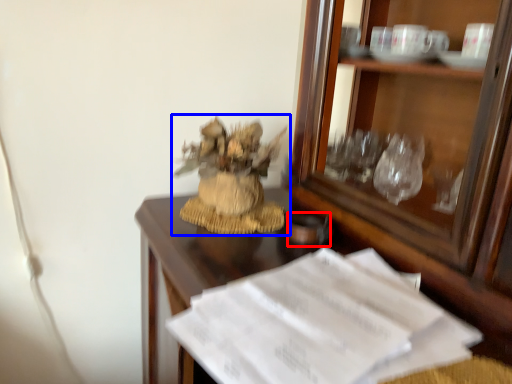
Question: Which object is closer to the camera taking this photo, tableware (highlighted by a red box) or houseplant (highlighted by a blue box)?

Choices:
 (A) tableware
 (B) houseplant

Answer: (B)